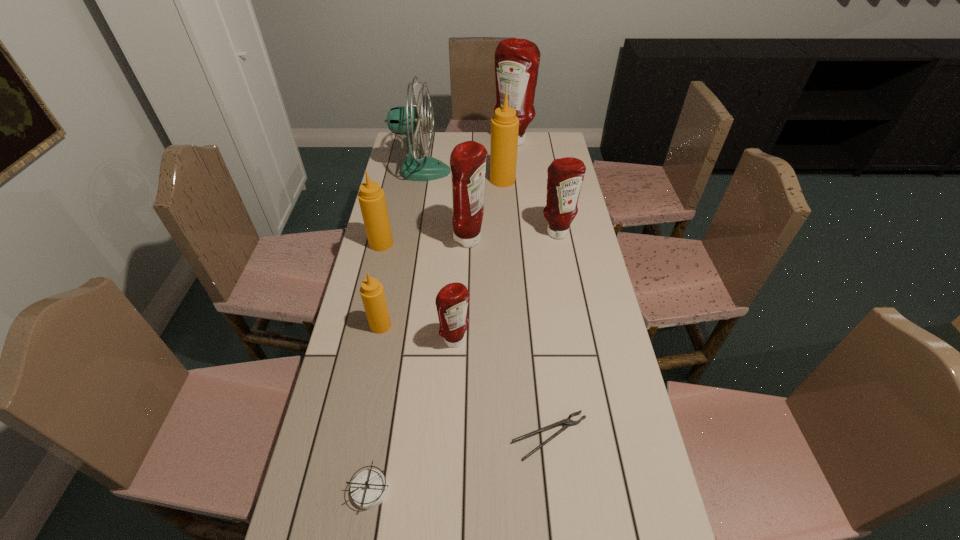
Where is `the farthest red condiment`? the farthest red condiment is located at coordinates (517, 61).

The width and height of the screenshot is (960, 540). What are the coordinates of `the tallest condiment` in the screenshot? It's located at (517, 61).

I want to click on fan, so click(407, 120).

Where is `the farthest tan condiment`? the farthest tan condiment is located at coordinates (504, 125).

At what (x,y) coordinates should I click in order to perform the action: click on the biggest tan condiment. Please return your answer as a coordinate pair (x, y). The width and height of the screenshot is (960, 540). Looking at the image, I should click on (504, 125).

You are a GUI agent. You are given a task and a screenshot of the screen. Output one action in this format:
    pyautogui.click(x=<x>, y=<y>)
    Task: Click on the second biggest red condiment
    
    Given the screenshot: What is the action you would take?
    tap(468, 159)

Where is `the second smallest tan condiment`? This screenshot has height=540, width=960. the second smallest tan condiment is located at coordinates (371, 197).

Locate an element on the screen. This screenshot has width=960, height=540. the third biggest red condiment is located at coordinates (565, 175).

The width and height of the screenshot is (960, 540). What are the coordinates of `the smallest red condiment` in the screenshot? It's located at (452, 300).

Locate an element on the screen. The image size is (960, 540). the smallest tan condiment is located at coordinates point(372,293).